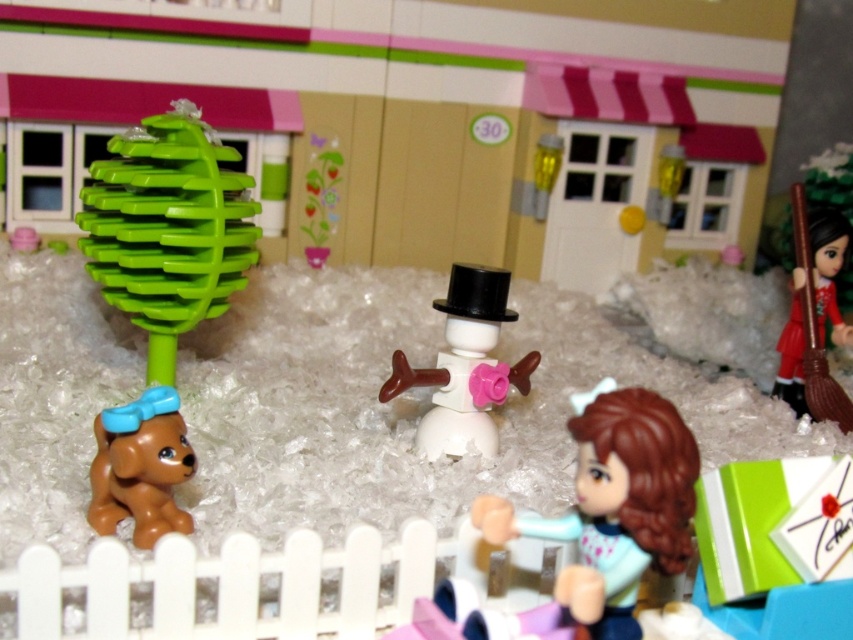
You are a visitor in this miniature village and you see the smooth brown hair at lower right and the brown glossy dog at lower left. Which object is located closer to the ground?

The smooth brown hair at lower right is positioned under the brown glossy dog at lower left, so it is closer to the ground.

You are a visitor in this LEGO town and notice a snowman with a black top. Can you identify the location of the smooth brown hair at lower right in the scene?

The smooth brown hair at lower right is located at point [614,506] in the scene.

Consider the image. In the LEGO village scene, there is a smooth brown hair at lower right and a white matte snowman at center. Which object is shorter?

The smooth brown hair at lower right is shorter than the white matte snowman at center.